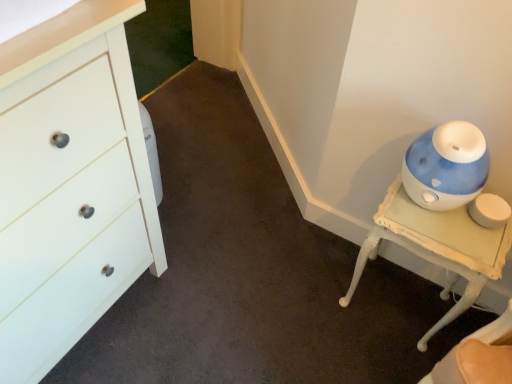
Question: Is white matte chest of drawers at left next to blue glossy humidifier at right and touching it?

Choices:
 (A) yes
 (B) no

Answer: (B)

Question: Does white matte chest of drawers at left have a smaller size compared to blue glossy humidifier at right?

Choices:
 (A) yes
 (B) no

Answer: (B)

Question: From a real-world perspective, is white matte chest of drawers at left over blue glossy humidifier at right?

Choices:
 (A) yes
 (B) no

Answer: (A)

Question: Does white matte chest of drawers at left have a lesser width compared to blue glossy humidifier at right?

Choices:
 (A) no
 (B) yes

Answer: (A)

Question: From a real-world perspective, does white matte chest of drawers at left sit lower than blue glossy humidifier at right?

Choices:
 (A) no
 (B) yes

Answer: (A)

Question: Is white matte chest of drawers at left positioned in front of blue glossy humidifier at right?

Choices:
 (A) no
 (B) yes

Answer: (B)

Question: Does blue glossy humidifier at right have a smaller size compared to white matte chest of drawers at left?

Choices:
 (A) yes
 (B) no

Answer: (A)

Question: From the image's perspective, is blue glossy humidifier at right under white matte chest of drawers at left?

Choices:
 (A) no
 (B) yes

Answer: (B)

Question: Can you confirm if blue glossy humidifier at right is thinner than white matte chest of drawers at left?

Choices:
 (A) no
 (B) yes

Answer: (B)

Question: Is blue glossy humidifier at right positioned in front of white matte chest of drawers at left?

Choices:
 (A) yes
 (B) no

Answer: (B)

Question: Does blue glossy humidifier at right appear on the left side of white matte chest of drawers at left?

Choices:
 (A) no
 (B) yes

Answer: (A)

Question: Is blue glossy humidifier at right not close to white matte chest of drawers at left?

Choices:
 (A) yes
 (B) no

Answer: (B)

Question: Based on their sizes in the image, would you say white matte chest of drawers at left is bigger or smaller than blue glossy humidifier at right?

Choices:
 (A) big
 (B) small

Answer: (A)